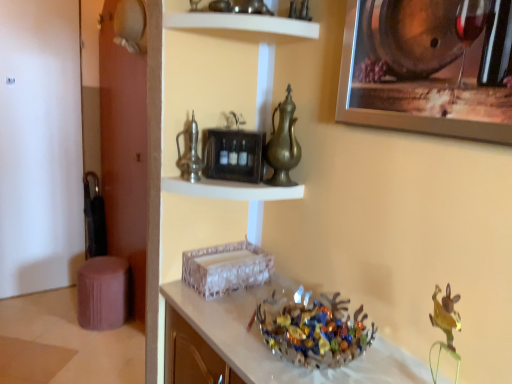
The height and width of the screenshot is (384, 512). Find the location of `purple fabric stool at lower left`. purple fabric stool at lower left is located at coordinates (103, 293).

Describe the element at coordinates (269, 350) in the screenshot. I see `translucent glass bowl at center` at that location.

Describe the element at coordinates (230, 189) in the screenshot. Image resolution: width=512 pixels, height=384 pixels. I see `metallic silver clock at upper center, which is counted as the 2th shelf, starting from the top` at that location.

Where is `metallic silver clock at upper center, which is counted as the 2th shelf, starting from the top`? This screenshot has height=384, width=512. metallic silver clock at upper center, which is counted as the 2th shelf, starting from the top is located at coordinates (230, 189).

What is the approximate height of metallic silver picture frame at upper right?

It is 32.99 centimeters.

What do you see at coordinates (428, 67) in the screenshot? I see `metallic silver picture frame at upper right` at bounding box center [428, 67].

Locate an element on the screen. The width and height of the screenshot is (512, 384). brass metallic pitcher at center is located at coordinates (283, 144).

From the image's perspective, is metallic silver picture frame at upper right located above or below brass metallic pitcher at center?

Based on their image positions, metallic silver picture frame at upper right is located above brass metallic pitcher at center.

In order to click on glass vase located below the metallic silver picture frame at upper right (from the image's perspective) in this screenshot , I will do `click(283, 144)`.

Considering the sizes of objects metallic silver picture frame at upper right and brass metallic pitcher at center in the image provided, who is taller, metallic silver picture frame at upper right or brass metallic pitcher at center?

Standing taller between the two is metallic silver picture frame at upper right.

From a real-world perspective, is metallic silver picture frame at upper right above or below brass metallic pitcher at center?

metallic silver picture frame at upper right is above brass metallic pitcher at center.

Choose the correct answer: Is brass metallic pitcher at center inside translucent glass bowl at center or outside it?

brass metallic pitcher at center is outside translucent glass bowl at center.

Who is shorter, brass metallic pitcher at center or translucent glass bowl at center?

brass metallic pitcher at center.

Is brass metallic pitcher at center at the left side of translucent glass bowl at center?

In fact, brass metallic pitcher at center is to the right of translucent glass bowl at center.

From the image's perspective, is brass metallic pitcher at center located above or below translucent glass bowl at center?

Clearly, from the image's perspective, brass metallic pitcher at center is above translucent glass bowl at center.

Is brass metallic pitcher at center positioned with its back to shiny metallic bowl at center?

brass metallic pitcher at center is not turned away from shiny metallic bowl at center.

Does brass metallic pitcher at center have a lesser width compared to shiny metallic bowl at center?

Indeed, brass metallic pitcher at center has a lesser width compared to shiny metallic bowl at center.

Is brass metallic pitcher at center in contact with shiny metallic bowl at center?

No, brass metallic pitcher at center is not making contact with shiny metallic bowl at center.

How distant is brass metallic pitcher at center from shiny metallic bowl at center?

brass metallic pitcher at center is 17.71 inches away from shiny metallic bowl at center.

Is translucent glass bowl at center inside purple fabric stool at lower left?

Actually, translucent glass bowl at center is outside purple fabric stool at lower left.

In the scene shown: Based on their positions, is purple fabric stool at lower left located to the left or right of translucent glass bowl at center?

Result: purple fabric stool at lower left is to the left of translucent glass bowl at center.

Consider the image. Can you tell me how much purple fabric stool at lower left and translucent glass bowl at center differ in facing direction?

91.2 degrees separate the facing orientations of purple fabric stool at lower left and translucent glass bowl at center.

From the image's perspective, which is above, purple fabric stool at lower left or translucent glass bowl at center?

translucent glass bowl at center.

Is purple fabric stool at lower left positioned far away from brass metallic pitcher at center?

Indeed, purple fabric stool at lower left is not near brass metallic pitcher at center.

The width and height of the screenshot is (512, 384). In order to click on stool that appears below the brass metallic pitcher at center (from the image's perspective) in this screenshot , I will do `click(103, 293)`.

From the image's perspective, is purple fabric stool at lower left located above or below brass metallic pitcher at center?

Clearly, from the image's perspective, purple fabric stool at lower left is below brass metallic pitcher at center.

Based on the photo, is the position of purple fabric stool at lower left less distant than that of brass metallic pitcher at center?

No.

Looking at this image, does metallic silver picture frame at upper right lie behind translucent glass bowl at center?

That is False.

From the picture: Does metallic silver picture frame at upper right appear on the left side of translucent glass bowl at center?

No.

Is metallic silver picture frame at upper right wider than translucent glass bowl at center?

No.

From a real-world perspective, is metallic silver picture frame at upper right on translucent glass bowl at center?

Indeed, from a real-world perspective, metallic silver picture frame at upper right stands above translucent glass bowl at center.

Find the location of a particular element. stool that is below the white glossy shelf at upper center, which is counted as the 2th shelf, starting from the bottom (from the image's perspective) is located at coordinates (103, 293).

Which is less distant, (100, 286) or (167, 27)?

Point (100, 286) is farther from the camera than point (167, 27).

Do you think purple fabric stool at lower left is within white glossy shelf at upper center, which is counted as the 2th shelf, starting from the bottom, or outside of it?

purple fabric stool at lower left exists outside the volume of white glossy shelf at upper center, which is counted as the 2th shelf, starting from the bottom.

Is purple fabric stool at lower left next to white glossy shelf at upper center, which is counted as the 2th shelf, starting from the bottom, and touching it?

No, purple fabric stool at lower left is not touching white glossy shelf at upper center, which is counted as the 2th shelf, starting from the bottom.

Where is `picture frame above the brass metallic pitcher at center (from a real-world perspective)`? Image resolution: width=512 pixels, height=384 pixels. picture frame above the brass metallic pitcher at center (from a real-world perspective) is located at coordinates coord(428,67).

Locate an element on the screen. counter on the left of brass metallic pitcher at center is located at coordinates (269, 350).

From the image, which object appears to be nearer to brass metallic pitcher at center, translucent glass bowl at center or shiny metallic bowl at center?

Among the two, shiny metallic bowl at center is located nearer to brass metallic pitcher at center.

From the image, which object appears to be nearer to shiny metallic bowl at center, brass metallic pitcher at center or translucent glass bowl at center?

translucent glass bowl at center is positioned closer to the anchor shiny metallic bowl at center.

Estimate the real-world distances between objects in this image. Which object is further from purple fabric stool at lower left, white glossy shelf at upper center, which is counted as the 2th shelf, starting from the bottom, or translucent glass bowl at center?

white glossy shelf at upper center, which is counted as the 2th shelf, starting from the bottom, is positioned further to the anchor purple fabric stool at lower left.

Which object lies nearer to the anchor point white glossy shelf at upper center, which is counted as the 2th shelf, starting from the bottom, metallic silver picture frame at upper right or brass metallic pitcher at center?

brass metallic pitcher at center is positioned closer to the anchor white glossy shelf at upper center, which is counted as the 2th shelf, starting from the bottom.

Considering their positions, is metallic silver clock at upper center, the 1th shelf in the bottom-to-top sequence, positioned further to metallic silver picture frame at upper right than purple fabric stool at lower left?

purple fabric stool at lower left is further to metallic silver picture frame at upper right.

Based on their spatial positions, is metallic silver picture frame at upper right or metallic silver clock at upper center, which is counted as the 2th shelf, starting from the top, closer to shiny metallic bowl at center?

Based on the image, metallic silver clock at upper center, which is counted as the 2th shelf, starting from the top, appears to be nearer to shiny metallic bowl at center.

Looking at the image, which one is located further to white glossy shelf at upper center, which is counted as the 2th shelf, starting from the bottom, metallic silver clock at upper center, which is counted as the 2th shelf, starting from the top, or purple fabric stool at lower left?

The object further to white glossy shelf at upper center, which is counted as the 2th shelf, starting from the bottom, is purple fabric stool at lower left.

Which object lies nearer to the anchor point metallic silver clock at upper center, which is counted as the 2th shelf, starting from the top, shiny metallic bowl at center or translucent glass bowl at center?

Among the two, translucent glass bowl at center is located nearer to metallic silver clock at upper center, which is counted as the 2th shelf, starting from the top.

The image size is (512, 384). Find the location of `glass vase that lies between white glossy shelf at upper center, which is counted as the 2th shelf, starting from the bottom, and shiny metallic bowl at center from top to bottom`. glass vase that lies between white glossy shelf at upper center, which is counted as the 2th shelf, starting from the bottom, and shiny metallic bowl at center from top to bottom is located at coordinates coord(283,144).

The height and width of the screenshot is (384, 512). In order to click on shelf between metallic silver picture frame at upper right and shiny metallic bowl at center vertically in this screenshot , I will do `click(230, 189)`.

What are the coordinates of `shelf that lies between brass metallic pitcher at center and shiny metallic bowl at center from top to bottom` in the screenshot? It's located at (230, 189).

I want to click on shelf between white glossy shelf at upper center, which is counted as the 2th shelf, starting from the bottom, and translucent glass bowl at center, in the vertical direction, so click(230, 189).